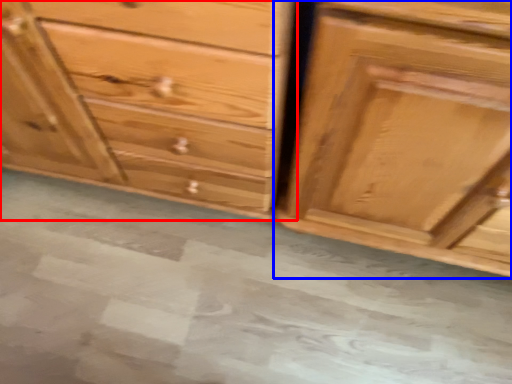
Question: Among these objects, which one is nearest to the camera, chest of drawers (highlighted by a red box) or chest of drawers (highlighted by a blue box)?

Choices:
 (A) chest of drawers
 (B) chest of drawers

Answer: (B)